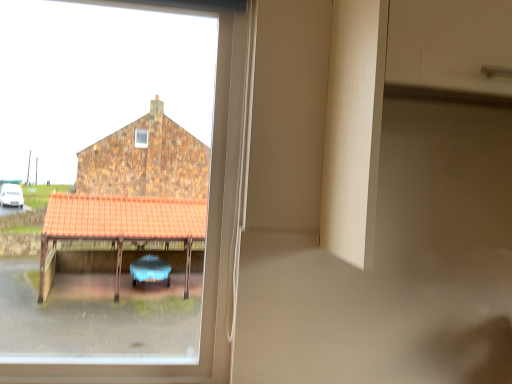
In order to click on transparent glass window at center in this screenshot , I will do `click(206, 258)`.

Describe the element at coordinates (206, 258) in the screenshot. I see `transparent glass window at center` at that location.

Locate an element on the screen. The width and height of the screenshot is (512, 384). transparent glass window at center is located at coordinates (206, 258).